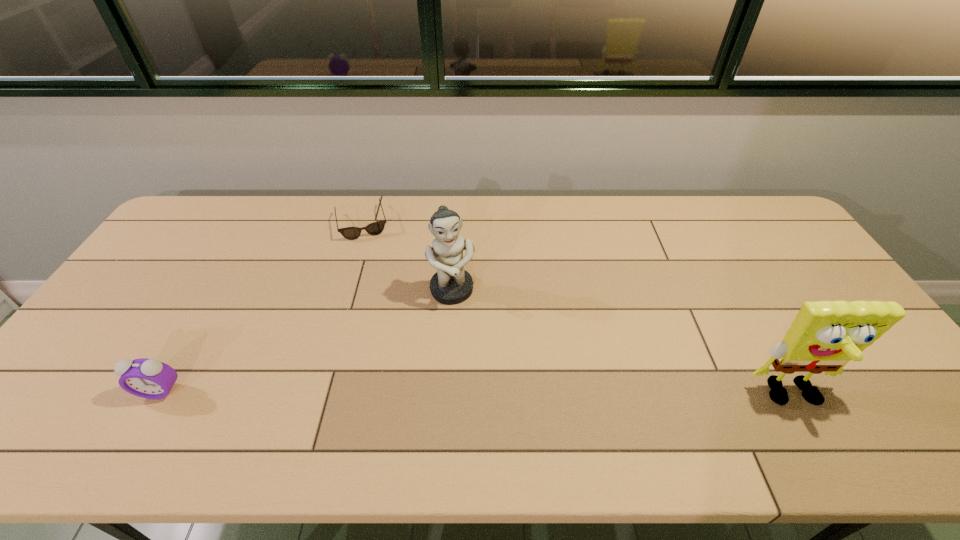
Identify the location of object that is the nearest to the sunglasses. The image size is (960, 540). (451, 284).